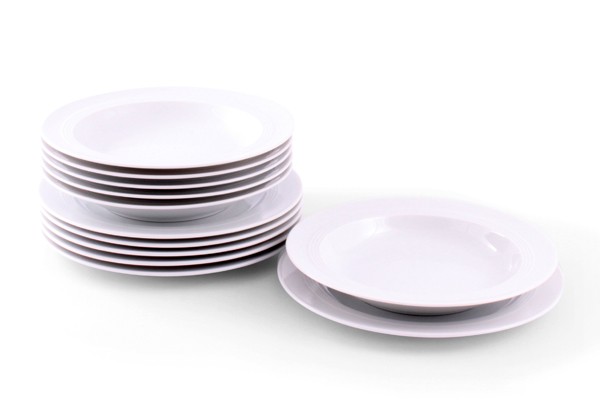
What are the coordinates of `bowls` in the screenshot? It's located at (187, 204), (197, 196), (206, 184), (212, 172), (218, 162), (337, 286).